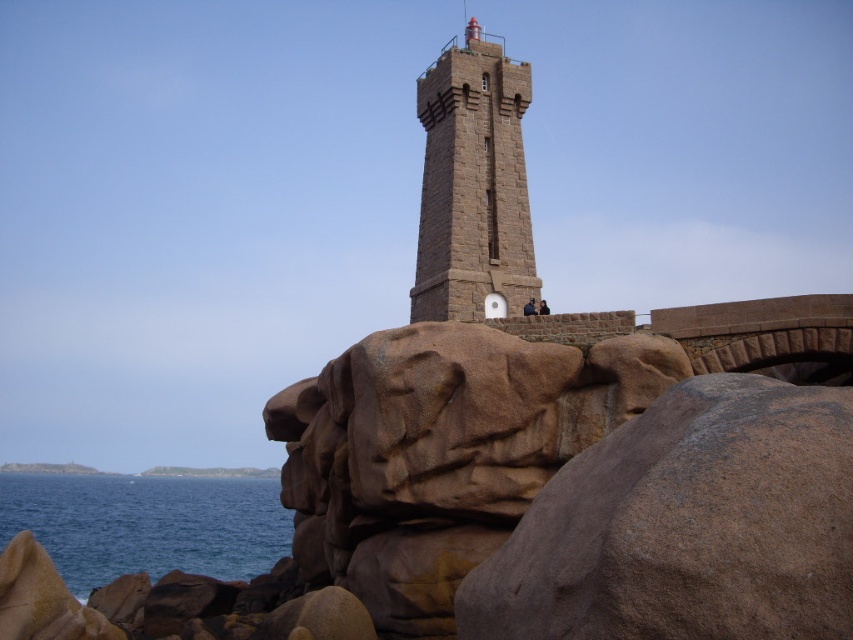
The width and height of the screenshot is (853, 640). Find the location of `brown stone tower at center`. brown stone tower at center is located at coordinates (473, 186).

Is brown stone tower at center further to camera compared to blue water at lower left?

No, it is not.

Which is behind, point (503, 177) or point (184, 570)?

Point (184, 570)

Image resolution: width=853 pixels, height=640 pixels. Find the location of `brown stone tower at center`. brown stone tower at center is located at coordinates (473, 186).